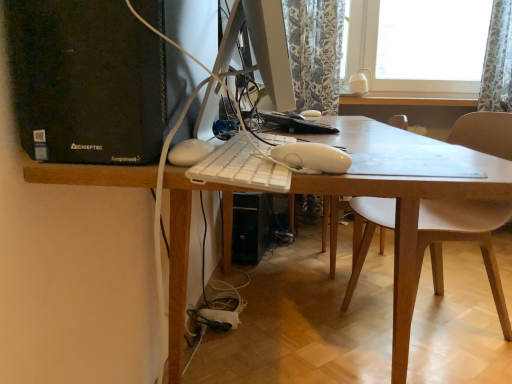
Question: Can you confirm if white plastic keyboard at center is bigger than white plastic desk at center?

Choices:
 (A) no
 (B) yes

Answer: (A)

Question: From the image's perspective, is white plastic keyboard at center below white plastic desk at center?

Choices:
 (A) no
 (B) yes

Answer: (A)

Question: From a real-world perspective, is white plastic keyboard at center located higher than white plastic desk at center?

Choices:
 (A) yes
 (B) no

Answer: (A)

Question: Is white plastic keyboard at center to the right of white plastic desk at center from the viewer's perspective?

Choices:
 (A) yes
 (B) no

Answer: (B)

Question: Could you tell me if white plastic keyboard at center is facing white plastic desk at center?

Choices:
 (A) no
 (B) yes

Answer: (A)

Question: Is white plastic keyboard at center wider or thinner than white plastic desk at center?

Choices:
 (A) thin
 (B) wide

Answer: (A)

Question: From a real-world perspective, is white plastic keyboard at center positioned above or below white plastic desk at center?

Choices:
 (A) below
 (B) above

Answer: (B)

Question: Considering the positions of point (230, 153) and point (174, 349), is point (230, 153) closer or farther from the camera than point (174, 349)?

Choices:
 (A) farther
 (B) closer

Answer: (B)

Question: From the image's perspective, relative to white plastic desk at center, is white plastic keyboard at center above or below?

Choices:
 (A) above
 (B) below

Answer: (A)

Question: Considering the positions of point click(x=84, y=79) and point click(x=178, y=380), is point click(x=84, y=79) closer or farther from the camera than point click(x=178, y=380)?

Choices:
 (A) closer
 (B) farther

Answer: (A)

Question: From the image's perspective, relative to white plastic desk at center, is black plastic computer tower at left above or below?

Choices:
 (A) above
 (B) below

Answer: (A)

Question: In terms of height, does black plastic computer tower at left look taller or shorter compared to white plastic desk at center?

Choices:
 (A) tall
 (B) short

Answer: (B)

Question: Visually, is black plastic computer tower at left positioned to the left or to the right of white plastic desk at center?

Choices:
 (A) left
 (B) right

Answer: (A)

Question: Considering the positions of floral fabric curtain at upper right and white plastic keyboard at center in the image, is floral fabric curtain at upper right bigger or smaller than white plastic keyboard at center?

Choices:
 (A) small
 (B) big

Answer: (B)

Question: Considering their positions, is floral fabric curtain at upper right located in front of or behind white plastic keyboard at center?

Choices:
 (A) front
 (B) behind

Answer: (B)